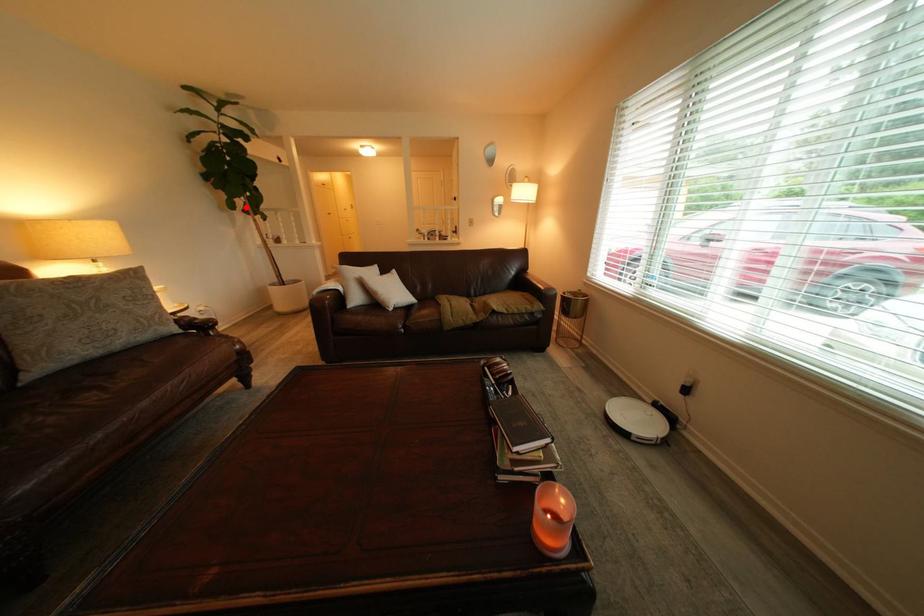
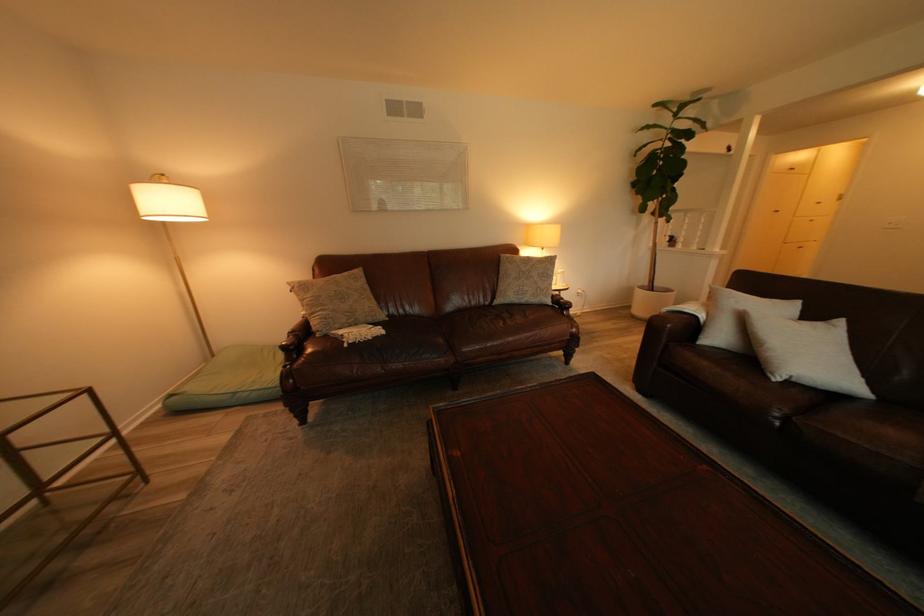
Where in the second image is the point corresponding to the highlighted location from the first image?

(657, 209)